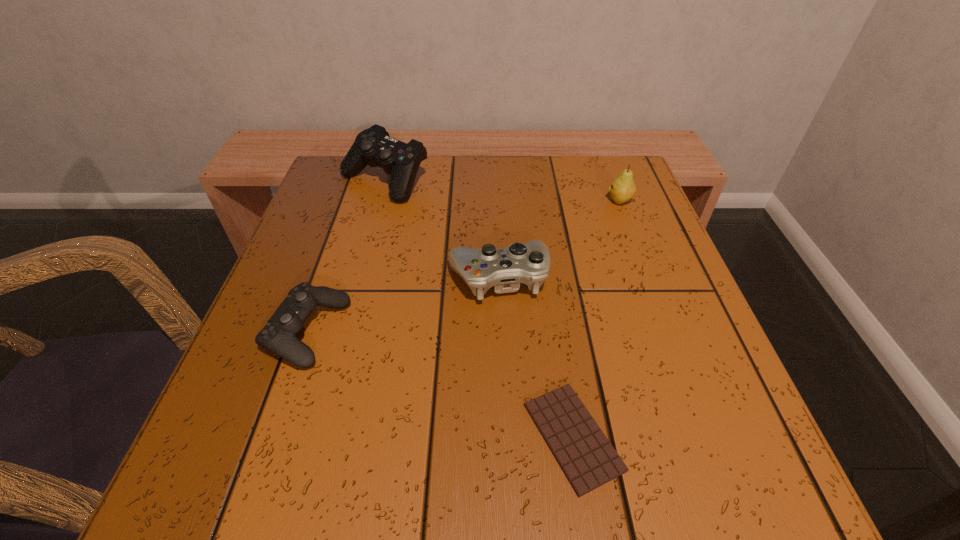
This screenshot has height=540, width=960. Identify the location of empty space between the second tallest control and the chocolate bar. (536, 357).

I want to click on empty space between the third shortest object and the rightmost object, so [559, 239].

Locate which object ranks in proximity to the pear. Please provide its 2D coordinates. Your answer should be formatted as a tuple, i.e. [(x, y)], where the tuple contains the x and y coordinates of a point satisfying the conditions above.

[(504, 269)]

Identify which object is located as the third nearest to the second tallest control. Please provide its 2D coordinates. Your answer should be formatted as a tuple, i.e. [(x, y)], where the tuple contains the x and y coordinates of a point satisfying the conditions above.

[(279, 334)]

Locate an element on the screen. The width and height of the screenshot is (960, 540). the closest control relative to the farthest control is located at coordinates (504, 269).

Choose which control is the second nearest neighbor to the rightmost object. Please provide its 2D coordinates. Your answer should be formatted as a tuple, i.e. [(x, y)], where the tuple contains the x and y coordinates of a point satisfying the conditions above.

[(373, 146)]

At what (x,y) coordinates should I click in order to perform the action: click on free spot that satisfies the following two spatial constraints: 1. on the front side of the rightmost control; 2. on the right side of the farthest control. Please return your answer as a coordinate pair (x, y). This screenshot has width=960, height=540. Looking at the image, I should click on (357, 277).

Find the location of a particular element. The width and height of the screenshot is (960, 540). free space in the image that satisfies the following two spatial constraints: 1. on the back side of the rightmost control; 2. on the right side of the fourth tallest object is located at coordinates (326, 277).